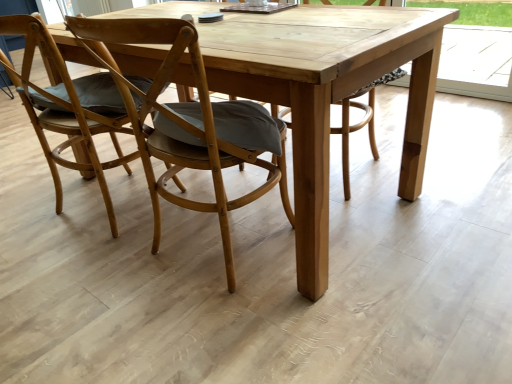
Question: Considering the positions of wooden chair with cushion at center, which is the 1th chair in right-to-left order, and natural wood picnic table at center in the image, is wooden chair with cushion at center, which is the 1th chair in right-to-left order, wider or thinner than natural wood picnic table at center?

Choices:
 (A) wide
 (B) thin

Answer: (B)

Question: Considering the positions of wooden chair with cushion at center, which is the 1th chair in right-to-left order, and natural wood picnic table at center in the image, is wooden chair with cushion at center, which is the 1th chair in right-to-left order, taller or shorter than natural wood picnic table at center?

Choices:
 (A) short
 (B) tall

Answer: (B)

Question: Which object is positioned closest to the wooden chair with cushion at center, which is the 2th chair from left to right?

Choices:
 (A) natural wood picnic table at center
 (B) wooden chair at left, positioned as the 1th chair in left-to-right order

Answer: (A)

Question: Based on their relative distances, which object is farther from the natural wood picnic table at center?

Choices:
 (A) wooden chair with cushion at center, which is the 1th chair in right-to-left order
 (B) wooden chair at left, marked as the 2th chair in a right-to-left arrangement

Answer: (B)